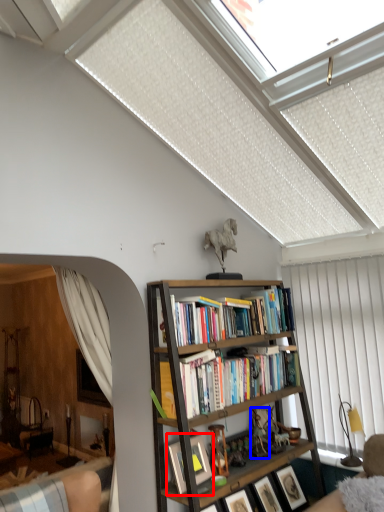
Question: Which object is closer to the camera taking this photo, picture frame (highlighted by a red box) or toy (highlighted by a blue box)?

Choices:
 (A) picture frame
 (B) toy

Answer: (A)